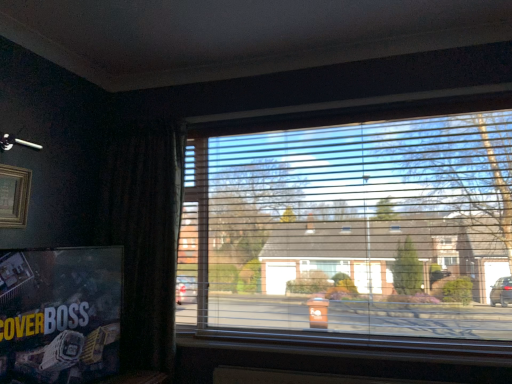
This screenshot has width=512, height=384. What do you see at coordinates (353, 229) in the screenshot?
I see `transparent plastic blinds at center` at bounding box center [353, 229].

Locate an element on the screen. The image size is (512, 384). wooden picture frame at upper left is located at coordinates (14, 196).

Is wooden at lower center not close to dark fabric curtain at left?

No, wooden at lower center is in close proximity to dark fabric curtain at left.

Can you confirm if wooden at lower center is taller than dark fabric curtain at left?

Incorrect, the height of wooden at lower center is not larger of that of dark fabric curtain at left.

Which object is further away from the camera taking this photo, wooden at lower center or dark fabric curtain at left?

dark fabric curtain at left is further from the camera.

Is wooden at lower center facing away from dark fabric curtain at left?

No, wooden at lower center is not facing the opposite direction of dark fabric curtain at left.

Is dark fabric curtain at left not inside matte black poster at lower left?

dark fabric curtain at left is positioned outside matte black poster at lower left.

From the image's perspective, is dark fabric curtain at left located above matte black poster at lower left?

Yes.

Is dark fabric curtain at left in front of matte black poster at lower left?

No.

Does dark fabric curtain at left have a lesser height compared to matte black poster at lower left?

In fact, dark fabric curtain at left may be taller than matte black poster at lower left.

Identify the location of curtain located on the left of transparent plastic blinds at center. (144, 235).

Measure the distance between transparent plastic blinds at center and dark fabric curtain at left.

transparent plastic blinds at center is 32.06 inches away from dark fabric curtain at left.

Could you tell me if transparent plastic blinds at center is facing dark fabric curtain at left?

No, transparent plastic blinds at center is not oriented towards dark fabric curtain at left.

In the scene shown: Is transparent plastic blinds at center smaller than dark fabric curtain at left?

Actually, transparent plastic blinds at center might be larger than dark fabric curtain at left.

Does dark fabric curtain at left have a lesser width compared to wooden at lower center?

No.

Does dark fabric curtain at left turn towards wooden at lower center?

No, dark fabric curtain at left does not turn towards wooden at lower center.

You are a GUI agent. You are given a task and a screenshot of the screen. Output one action in this format:
    pyautogui.click(x=<x>, y=<y>)
    Task: Click on the window sill that is under the dark fabric curtain at left (from a real-world perspective)
    
    Given the screenshot: What is the action you would take?
    pyautogui.click(x=350, y=345)

In the scene shown: Is dark fabric curtain at left to the right of wooden at lower center from the viewer's perspective?

In fact, dark fabric curtain at left is to the left of wooden at lower center.

Based on the photo, is transparent plastic blinds at center bigger or smaller than matte black poster at lower left?

In the image, transparent plastic blinds at center appears to be larger than matte black poster at lower left.

Is transparent plastic blinds at center far from matte black poster at lower left?

transparent plastic blinds at center is far away from matte black poster at lower left.

How many degrees apart are the facing directions of transparent plastic blinds at center and matte black poster at lower left?

76.7 degrees separate the facing orientations of transparent plastic blinds at center and matte black poster at lower left.

Considering the positions of objects transparent plastic blinds at center and matte black poster at lower left in the image provided, who is more to the right, transparent plastic blinds at center or matte black poster at lower left?

From the viewer's perspective, transparent plastic blinds at center appears more on the right side.

Would you consider matte black poster at lower left to be distant from wooden at lower center?

Absolutely, matte black poster at lower left is distant from wooden at lower center.

Can you confirm if matte black poster at lower left is bigger than wooden at lower center?

Correct, matte black poster at lower left is larger in size than wooden at lower center.

Does matte black poster at lower left have a lesser width compared to wooden at lower center?

No.

Is matte black poster at lower left positioned in front of wooden at lower center?

That is True.

From a real-world perspective, which is physically above, matte black poster at lower left or transparent plastic blinds at center?

transparent plastic blinds at center.

Which is less distant, [98,254] or [342,250]?

Clearly, point [98,254] is closer to the camera than point [342,250].

Is transparent plastic blinds at center inside matte black poster at lower left?

No, transparent plastic blinds at center is not surrounded by matte black poster at lower left.

Where is `window sill in front of the dark fabric curtain at left`? window sill in front of the dark fabric curtain at left is located at coordinates (350, 345).

At what (x,y) coordinates should I click in order to perform the action: click on tv show that is below the dark fabric curtain at left (from the image's perspective). Please return your answer as a coordinate pair (x, y). Looking at the image, I should click on (60, 315).

Considering their positions, is wooden picture frame at upper left positioned closer to transparent plastic blinds at center than matte black poster at lower left?

Based on the image, matte black poster at lower left appears to be nearer to transparent plastic blinds at center.

Which object lies nearer to the anchor point matte black poster at lower left, wooden at lower center or transparent plastic blinds at center?

wooden at lower center is positioned closer to the anchor matte black poster at lower left.

Looking at the image, which one is located further to matte black poster at lower left, wooden picture frame at upper left or dark fabric curtain at left?

dark fabric curtain at left.

From the image, which object appears to be farther from transparent plastic blinds at center, matte black poster at lower left or wooden at lower center?

Based on the image, matte black poster at lower left appears to be further to transparent plastic blinds at center.

From the image, which object appears to be nearer to wooden at lower center, transparent plastic blinds at center or wooden picture frame at upper left?

transparent plastic blinds at center lies closer to wooden at lower center than the other object.

Estimate the real-world distances between objects in this image. Which object is closer to wooden picture frame at upper left, dark fabric curtain at left or wooden at lower center?

dark fabric curtain at left lies closer to wooden picture frame at upper left than the other object.

Looking at the image, which one is located closer to dark fabric curtain at left, transparent plastic blinds at center or wooden picture frame at upper left?

The object closer to dark fabric curtain at left is wooden picture frame at upper left.

Considering their positions, is dark fabric curtain at left positioned further to matte black poster at lower left than transparent plastic blinds at center?

Based on the image, transparent plastic blinds at center appears to be further to matte black poster at lower left.

Find the location of a particular element. window sill between matte black poster at lower left and transparent plastic blinds at center in the horizontal direction is located at coordinates (350, 345).

The image size is (512, 384). In order to click on curtain between wooden picture frame at upper left and wooden at lower center in this screenshot , I will do `click(144, 235)`.

Find the location of a particular element. window sill situated between dark fabric curtain at left and transparent plastic blinds at center from left to right is located at coordinates (350, 345).

Find the location of a particular element. Image resolution: width=512 pixels, height=384 pixels. tv show between wooden picture frame at upper left and transparent plastic blinds at center from left to right is located at coordinates (60, 315).